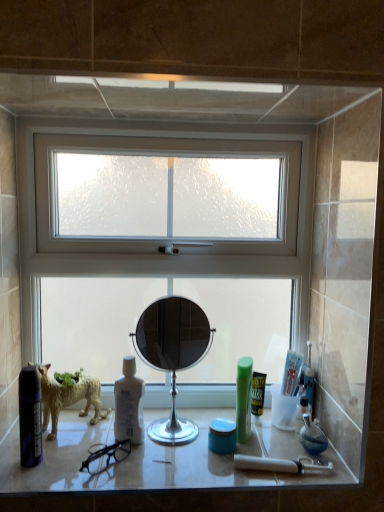
This screenshot has width=384, height=512. Identify the location of free location in front of green plastic bottle at center-right. (243, 474).